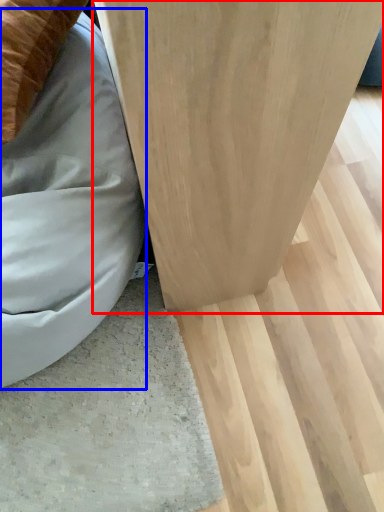
Question: Which object is closer to the camera taking this photo, furniture (highlighted by a red box) or bean bag chair (highlighted by a blue box)?

Choices:
 (A) furniture
 (B) bean bag chair

Answer: (A)